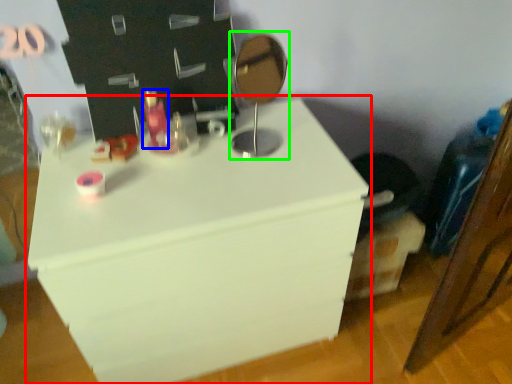
Question: Estimate the real-world distances between objects in this image. Which object is farther from furniture (highlighted by a red box), toiletry (highlighted by a blue box) or table lamp (highlighted by a green box)?

Choices:
 (A) toiletry
 (B) table lamp

Answer: (A)